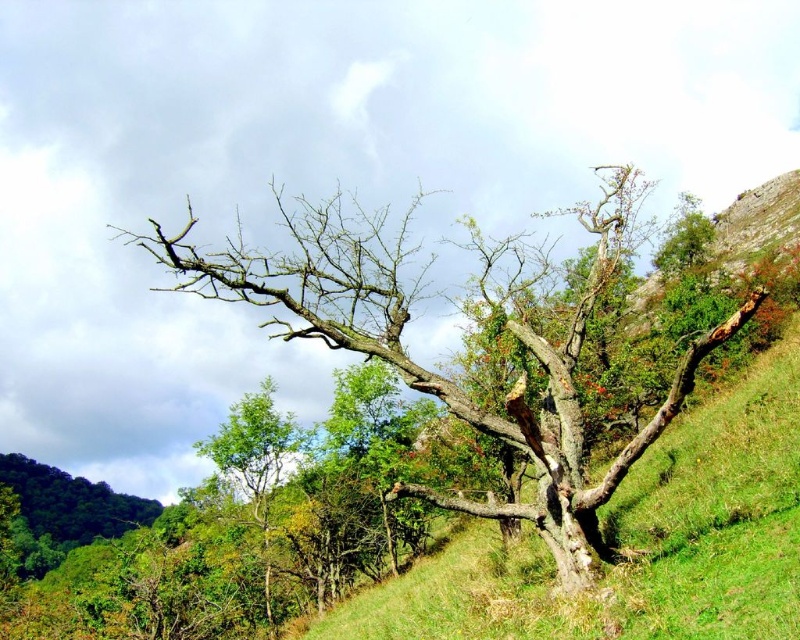
Question: Estimate the real-world distances between objects in this image. Which object is closer to the green grassy at center?

Choices:
 (A) barky brown tree at center
 (B) green leafy tree at lower left

Answer: (A)

Question: In this image, where is green grassy at center located relative to barky brown tree at center?

Choices:
 (A) below
 (B) above

Answer: (A)

Question: Does barky brown tree at center have a greater width compared to green leafy tree at lower left?

Choices:
 (A) yes
 (B) no

Answer: (A)

Question: Which of the following is the closest to the observer?

Choices:
 (A) (229, 460)
 (B) (620, 177)

Answer: (B)

Question: Is green grassy at center wider than barky brown tree at center?

Choices:
 (A) yes
 (B) no

Answer: (B)

Question: Which object is the closest to the green leafy tree at lower left?

Choices:
 (A) green grassy at center
 (B) barky brown tree at center

Answer: (A)